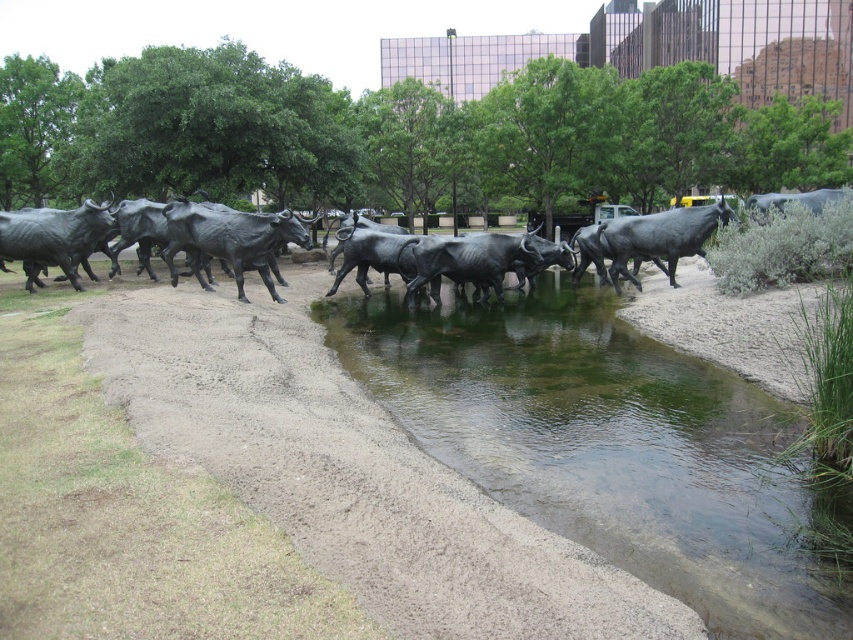
Question: Does polished bronze bull at left have a greater width compared to polished bronze bull at right?

Choices:
 (A) yes
 (B) no

Answer: (B)

Question: Which is nearer to the clear water at center?

Choices:
 (A) polished bronze bull at right
 (B) polished bronze bull at left

Answer: (A)

Question: Can you confirm if polished bronze bull at left is positioned to the left of polished bronze bull at right?

Choices:
 (A) no
 (B) yes

Answer: (B)

Question: Which of these objects is positioned farthest from the polished bronze bull at right?

Choices:
 (A) polished bronze bull at left
 (B) polished bronze bull at center
 (C) clear water at center

Answer: (A)

Question: Does clear water at center have a smaller size compared to polished bronze bull at right?

Choices:
 (A) no
 (B) yes

Answer: (A)

Question: Which of the following is the closest to the observer?

Choices:
 (A) polished bronze bull at left
 (B) clear water at center

Answer: (B)